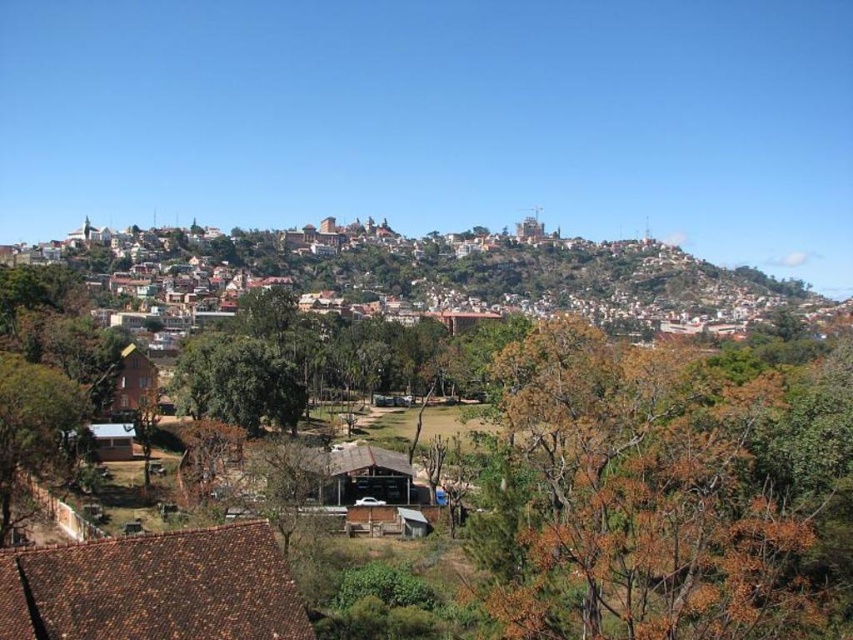
Does green leafy tree at lower left have a smaller size compared to brown wooden hut at lower left?

No, green leafy tree at lower left is not smaller than brown wooden hut at lower left.

Does green leafy tree at lower left appear on the right side of brown wooden hut at lower left?

Incorrect, green leafy tree at lower left is not on the right side of brown wooden hut at lower left.

Which is in front, point (80, 394) or point (111, 404)?

Point (80, 394) is in front.

Find the location of a particular element. The image size is (853, 640). green leafy tree at lower left is located at coordinates (32, 428).

Identify the location of brown tile roof at lower left. The height and width of the screenshot is (640, 853). (154, 588).

Can you confirm if brown tile roof at lower left is thinner than green leafy tree at center?

Yes.

Where is `brown tile roof at lower left`? brown tile roof at lower left is located at coordinates (154, 588).

Locate an element on the screen. This screenshot has width=853, height=640. brown tile roof at lower left is located at coordinates (154, 588).

Does brown leafy tree at lower right have a smaller size compared to green leafy tree at center?

Actually, brown leafy tree at lower right might be larger than green leafy tree at center.

Is point (795, 609) closer to camera compared to point (273, 420)?

Yes, it is.

I want to click on brown leafy tree at lower right, so click(660, 492).

Where is `brown leafy tree at lower right`? This screenshot has height=640, width=853. brown leafy tree at lower right is located at coordinates (660, 492).